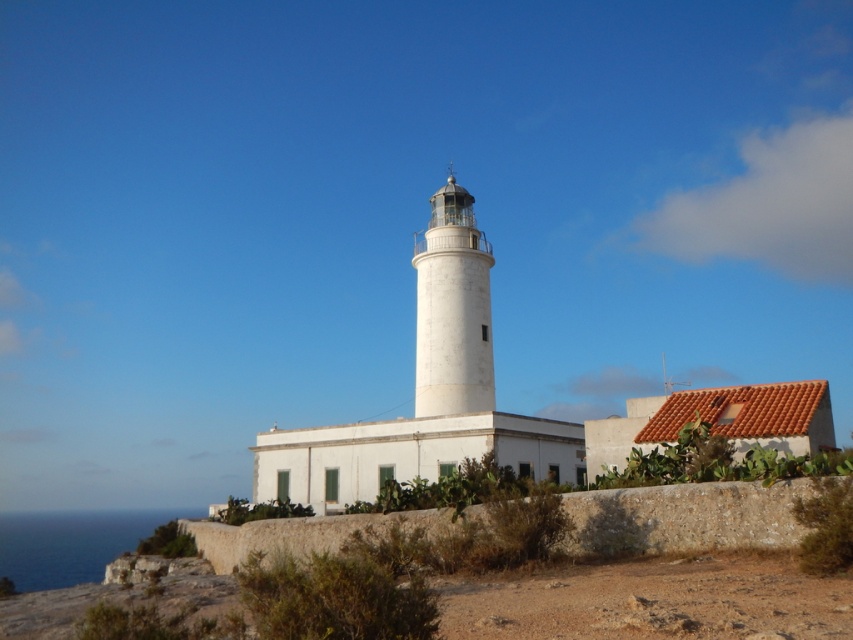
Question: Does brown rough stone wall at lower center have a greater width compared to white smooth lighthouse at center?

Choices:
 (A) no
 (B) yes

Answer: (B)

Question: Which point appears closest to the camera in this image?

Choices:
 (A) (430, 390)
 (B) (601, 548)

Answer: (B)

Question: Does brown rough stone wall at lower center appear on the left side of white smooth lighthouse at center?

Choices:
 (A) yes
 (B) no

Answer: (A)

Question: Which point is closer to the camera taking this photo?

Choices:
 (A) (567, 509)
 (B) (416, 304)

Answer: (A)

Question: Is brown rough stone wall at lower center closer to camera compared to white smooth lighthouse at center?

Choices:
 (A) yes
 (B) no

Answer: (A)

Question: Among these objects, which one is nearest to the camera?

Choices:
 (A) brown rough stone wall at lower center
 (B) white smooth lighthouse at center

Answer: (A)